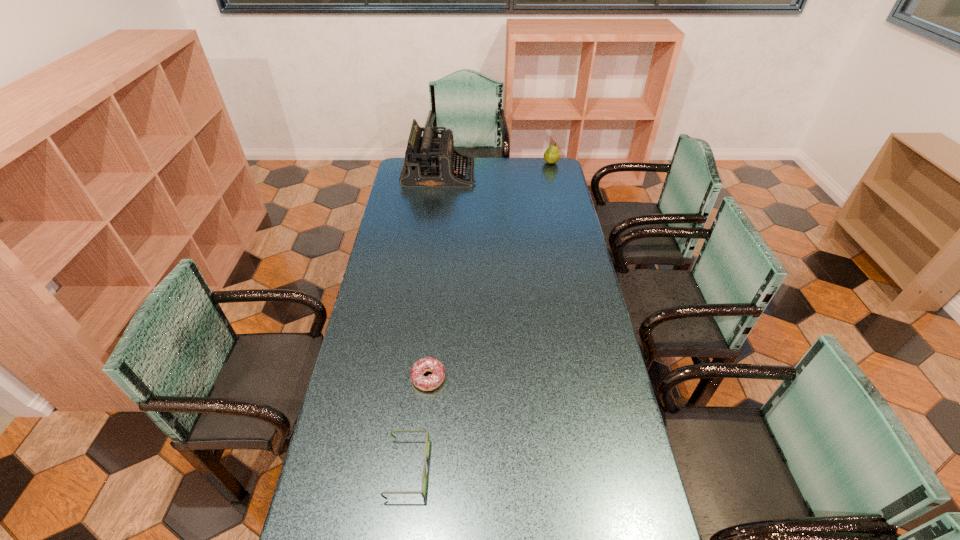
The width and height of the screenshot is (960, 540). I want to click on typewriter, so click(430, 162).

Where is `the third shortest object`? The width and height of the screenshot is (960, 540). the third shortest object is located at coordinates (551, 155).

Find the location of a particular element. The image size is (960, 540). pear is located at coordinates coord(551,155).

Locate an element on the screen. The width and height of the screenshot is (960, 540). spectacles is located at coordinates (423, 487).

Image resolution: width=960 pixels, height=540 pixels. What are the coordinates of `the second nearest object` in the screenshot? It's located at (429, 364).

Image resolution: width=960 pixels, height=540 pixels. Find the location of `the shortest object`. the shortest object is located at coordinates (429, 364).

At what (x,y) coordinates should I click in order to perform the action: click on free space located on the keyboard of the typewriter. Please return your answer as a coordinate pair (x, y). The width and height of the screenshot is (960, 540). Looking at the image, I should click on [485, 174].

Where is `vacant space located 0.150m on the left of the third shortest object`? vacant space located 0.150m on the left of the third shortest object is located at coordinates (516, 163).

I want to click on free space located on the lens of the nearest object, so click(x=541, y=469).

Find the location of a particular element. The image size is (960, 540). free space located on the front of the shortest object is located at coordinates (416, 508).